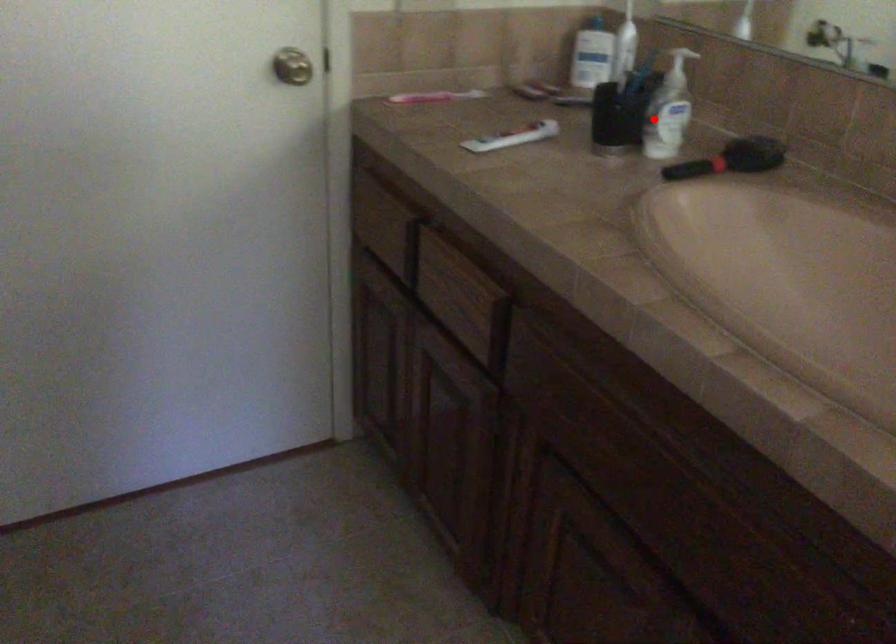
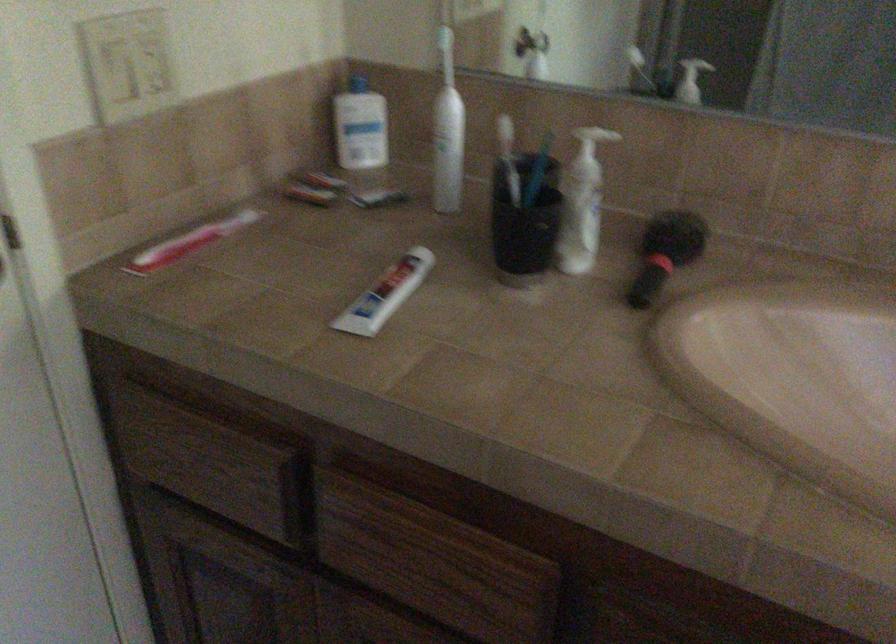
The point at the highlighted location is marked in the first image. Where is the corresponding point in the second image?

(579, 225)